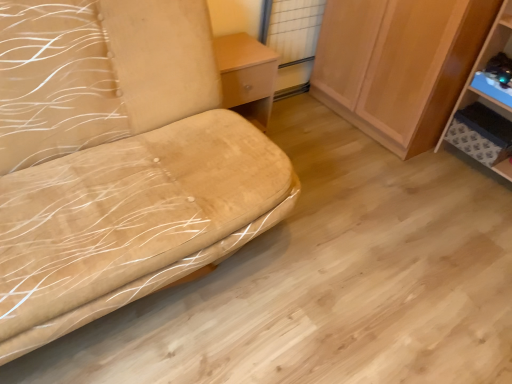
You are a GUI agent. You are given a task and a screenshot of the screen. Output one action in this format:
    pyautogui.click(x=<x>, y=<y>)
    Task: Click on the free location to the right of suede-like beige sofa at left
    The width and height of the screenshot is (512, 384).
    Given the screenshot: What is the action you would take?
    pyautogui.click(x=354, y=261)